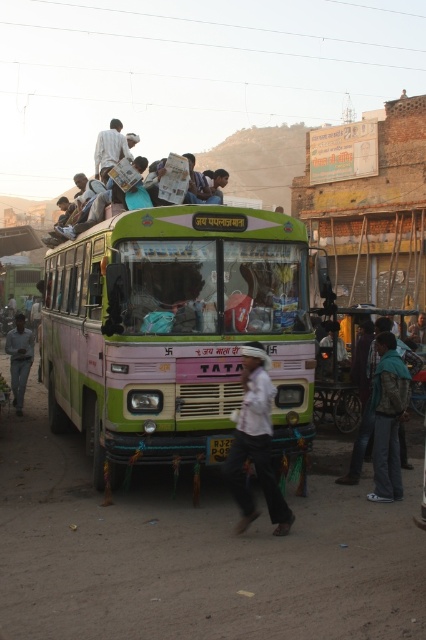
Measure the distance between green matte bus at center and camera.

6.13 meters

Which is more to the left, green matte bus at center or light brown fabric bag at upper center?

green matte bus at center

The width and height of the screenshot is (426, 640). What do you see at coordinates (175, 332) in the screenshot? I see `green matte bus at center` at bounding box center [175, 332].

Locate an element on the screen. green matte bus at center is located at coordinates (175, 332).

Based on the photo, does white cotton shirt at center appear on the right side of light brown fabric bag at upper center?

Yes, white cotton shirt at center is to the right of light brown fabric bag at upper center.

Does point (236, 484) lie in front of point (103, 198)?

That is True.

Identify the location of white cotton shirt at center. The height and width of the screenshot is (640, 426). (256, 444).

Who is shorter, green matte bus at center or white cotton shirt at center?

white cotton shirt at center is shorter.

Does green matte bus at center appear over white cotton shirt at center?

Yes.

Where is `green matte bus at center`? The image size is (426, 640). green matte bus at center is located at coordinates (175, 332).

Find the location of a particular element. The image size is (426, 640). green matte bus at center is located at coordinates pyautogui.click(x=175, y=332).